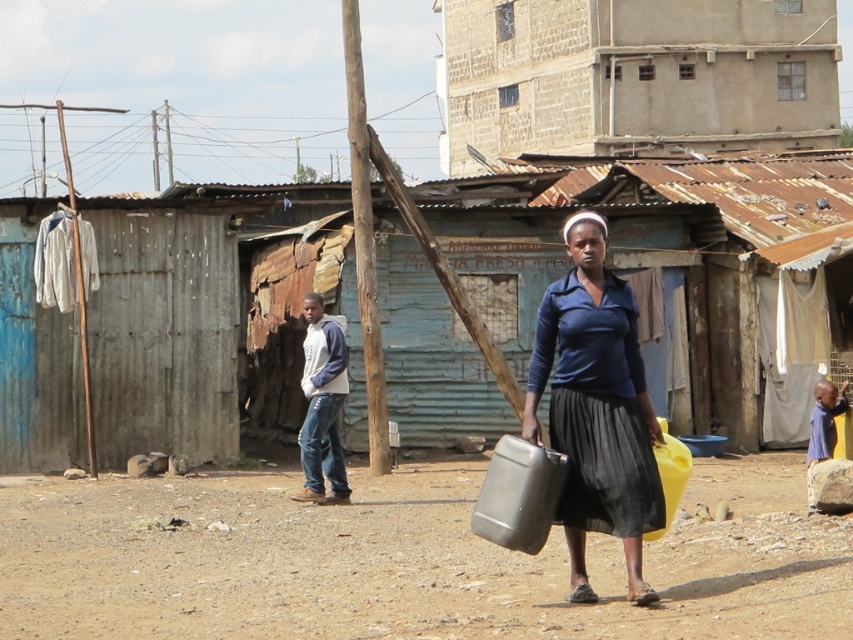
Who is shorter, brown dirt field at center or brown stucco building at upper center?

With less height is brown dirt field at center.

Based on the photo, who is more distant from viewer, (285, 572) or (778, 58)?

Point (778, 58)

What are the coordinates of `brown dirt field at center` in the screenshot? It's located at (404, 561).

Is brown dirt field at center to the right of matte black water container at center from the viewer's perspective?

Incorrect, brown dirt field at center is not on the right side of matte black water container at center.

Is brown dirt field at center taller than matte black water container at center?

In fact, brown dirt field at center may be shorter than matte black water container at center.

Based on the photo, who is more distant from viewer, (x=144, y=493) or (x=573, y=596)?

The point (x=144, y=493) is more distant.

I want to click on brown dirt field at center, so click(x=404, y=561).

Between rusty corrugated metal hut at center and brown stucco building at upper center, which one has less height?

Standing shorter between the two is rusty corrugated metal hut at center.

Can you confirm if rusty corrugated metal hut at center is positioned to the right of brown stucco building at upper center?

In fact, rusty corrugated metal hut at center is to the left of brown stucco building at upper center.

Is point (248, 397) closer to viewer compared to point (448, 3)?

Yes.

I want to click on rusty corrugated metal hut at center, so click(624, 221).